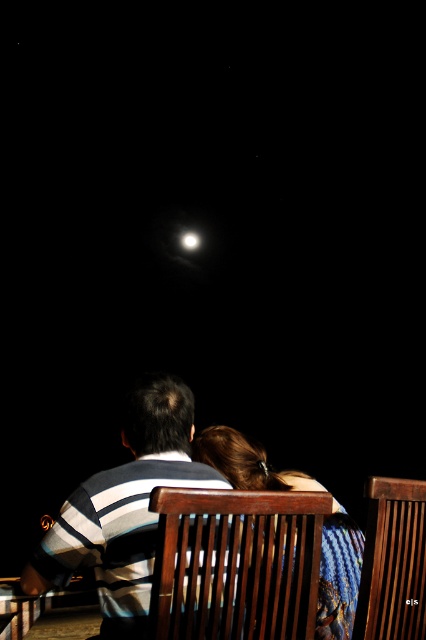
Question: Observing the image, what is the correct spatial positioning of blue textured fabric at center in reference to bright white orb at center?

Choices:
 (A) above
 (B) below

Answer: (B)

Question: Does blue textured fabric at center have a larger size compared to bright white orb at center?

Choices:
 (A) no
 (B) yes

Answer: (B)

Question: Considering the relative positions of striped fabric shirt at center and bright white orb at center in the image provided, where is striped fabric shirt at center located with respect to bright white orb at center?

Choices:
 (A) left
 (B) right

Answer: (B)

Question: Estimate the real-world distances between objects in this image. Which object is farther from the striped fabric shirt at center?

Choices:
 (A) blue textured fabric at center
 (B) bright white orb at center

Answer: (B)

Question: Which object appears farthest from the camera in this image?

Choices:
 (A) blue textured fabric at center
 (B) bright white orb at center

Answer: (B)

Question: Among these points, which one is nearest to the camera?

Choices:
 (A) (206, 429)
 (B) (94, 538)

Answer: (B)